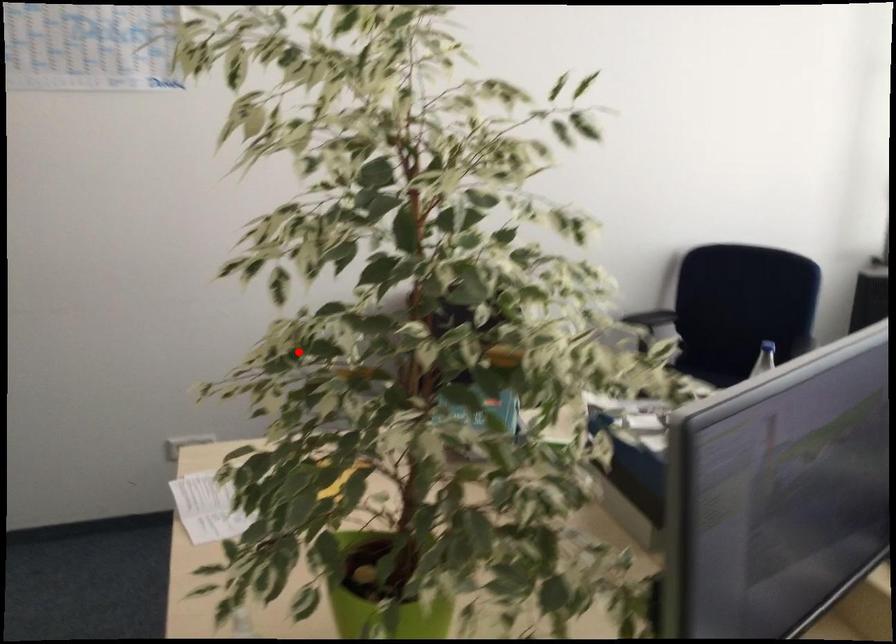
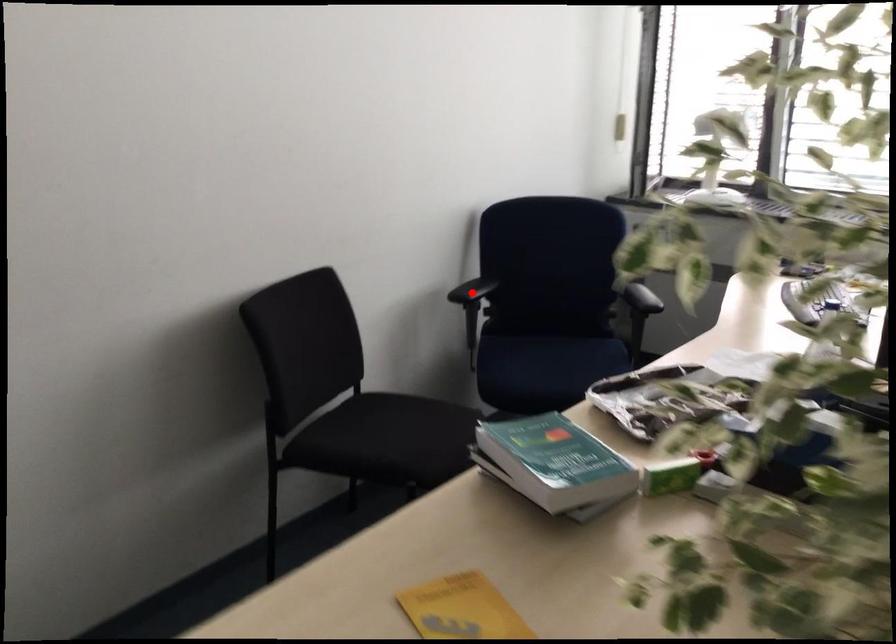
I am providing you with two images of the same scene from different viewpoints. A red point is marked on the first image and another point is marked on the second image. Does the point marked in image1 correspond to the same location as the one in image2?

No